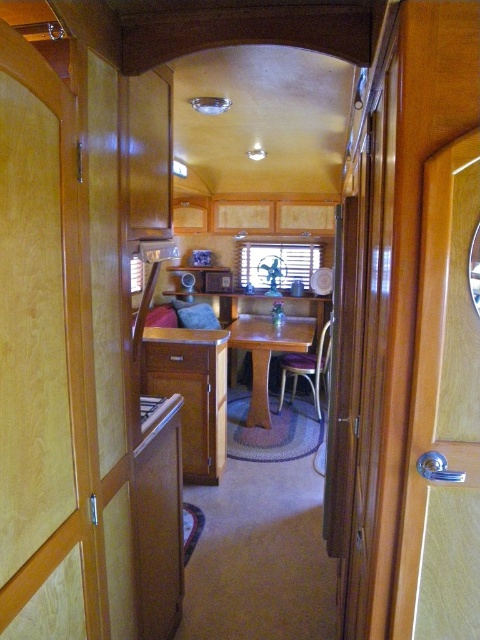
Question: Where is metallic purple chair at center located in relation to wooden drawer at center in the image?

Choices:
 (A) above
 (B) below

Answer: (B)

Question: Can you confirm if metallic purple chair at center is wider than wooden drawer at center?

Choices:
 (A) no
 (B) yes

Answer: (B)

Question: Which of the following is the closest to the observer?

Choices:
 (A) metallic purple chair at center
 (B) wooden table at center
 (C) wooden drawer at center

Answer: (C)

Question: Which of the following is the farthest from the observer?

Choices:
 (A) wooden table at center
 (B) metallic purple chair at center
 (C) wooden drawer at center

Answer: (B)

Question: Is metallic purple chair at center behind wooden drawer at center?

Choices:
 (A) no
 (B) yes

Answer: (B)

Question: Which point is closer to the camera?

Choices:
 (A) (147, 369)
 (B) (321, 352)
 (C) (266, 419)

Answer: (A)